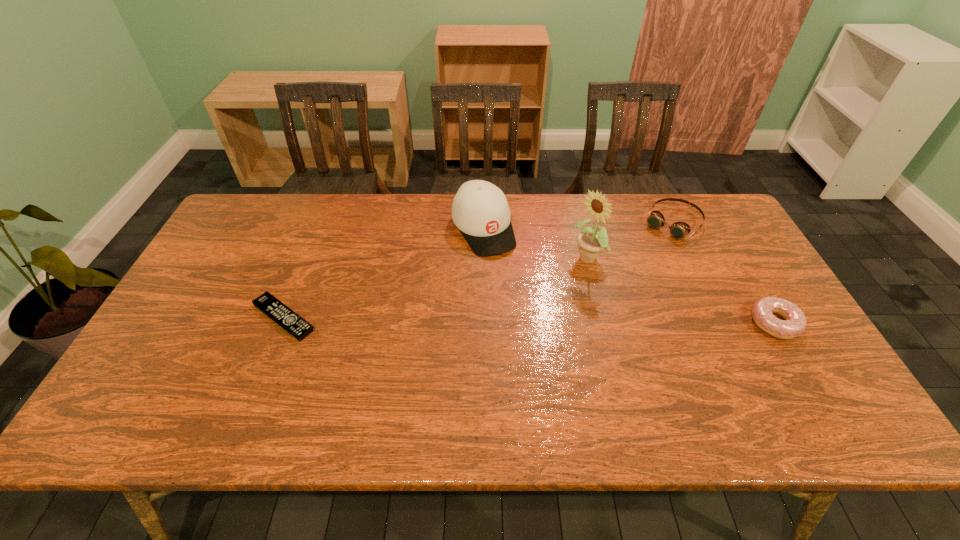
Image resolution: width=960 pixels, height=540 pixels. I want to click on vacant space on the desktop that is between the leftmost object and the doughnut and is positioned on the front-facing side of the second tallest object, so click(x=538, y=320).

Locate an element on the screen. free spot on the desktop that is between the leftmost object and the doughnut and is positioned on the front-facing side of the third object from left to right is located at coordinates (497, 320).

What are the coordinates of `vacant space on the desktop that is between the leftmost object and the doughnut and is positioned through the lenses of the goggles` in the screenshot? It's located at (586, 321).